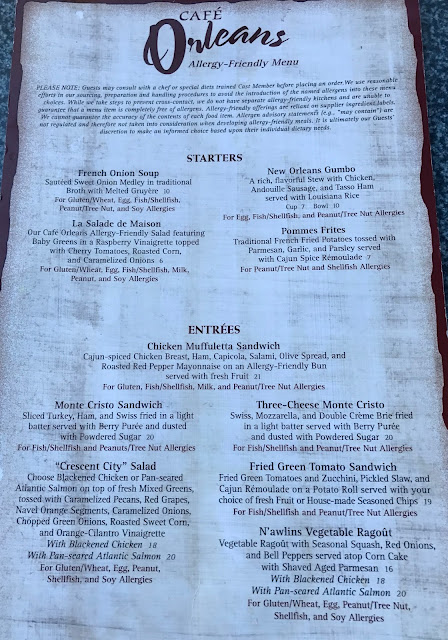
Locate an element on the screen. restaurant menu is located at coordinates (127, 173), (133, 226), (307, 164), (314, 233), (224, 342), (122, 404), (138, 468), (322, 410), (318, 470), (324, 534).